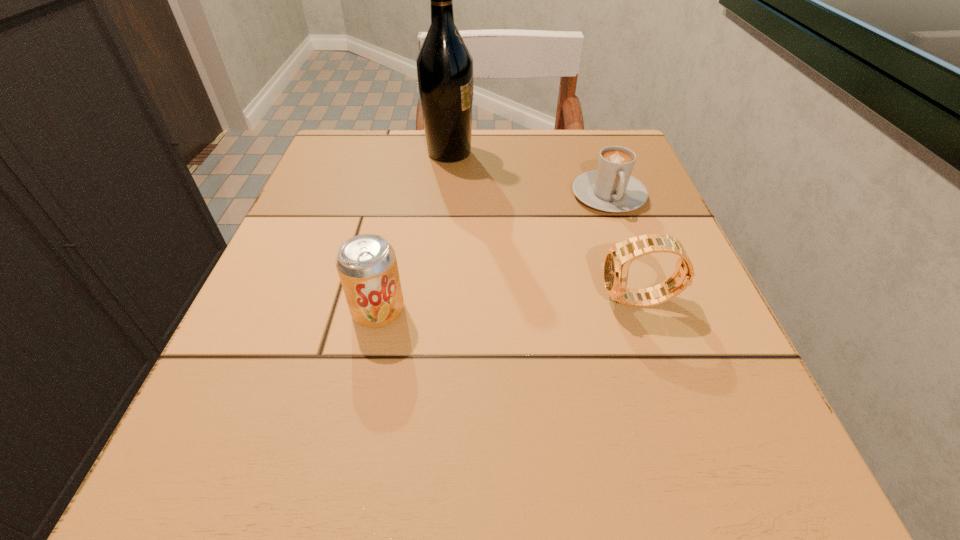
Where is `vacant space that's between the shortest object and the pop (soda)`? This screenshot has width=960, height=540. vacant space that's between the shortest object and the pop (soda) is located at coordinates (493, 253).

I want to click on vacant space that is in between the watch and the wine bottle, so click(544, 227).

You are a GUI agent. You are given a task and a screenshot of the screen. Output one action in this format:
    pyautogui.click(x=<x>, y=<y>)
    Task: Click on the closest object to the shortest object
    
    Given the screenshot: What is the action you would take?
    pos(618,259)

Identify the location of the second closest object relative to the tallest object. (367, 266).

Where is `vacant position in the image that satisfies the following two spatial constraints: 1. on the face of the watch; 2. on the front side of the pop (soda)`? vacant position in the image that satisfies the following two spatial constraints: 1. on the face of the watch; 2. on the front side of the pop (soda) is located at coordinates (642, 310).

Where is `vacant area that satisfies the following two spatial constraints: 1. to the right of the third nearest object; 2. on the face of the watch`? The width and height of the screenshot is (960, 540). vacant area that satisfies the following two spatial constraints: 1. to the right of the third nearest object; 2. on the face of the watch is located at coordinates (646, 301).